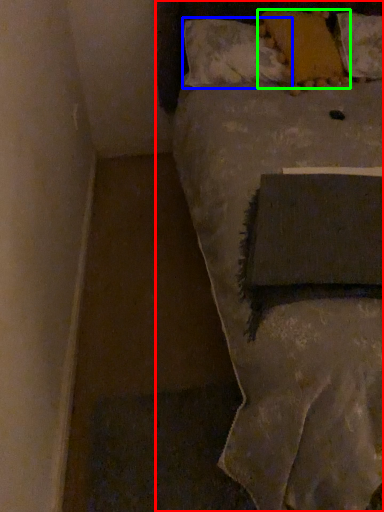
Question: Which is nearer to the bed (highlighted by a red box)? pillow (highlighted by a blue box) or pillow (highlighted by a green box).

Choices:
 (A) pillow
 (B) pillow

Answer: (A)